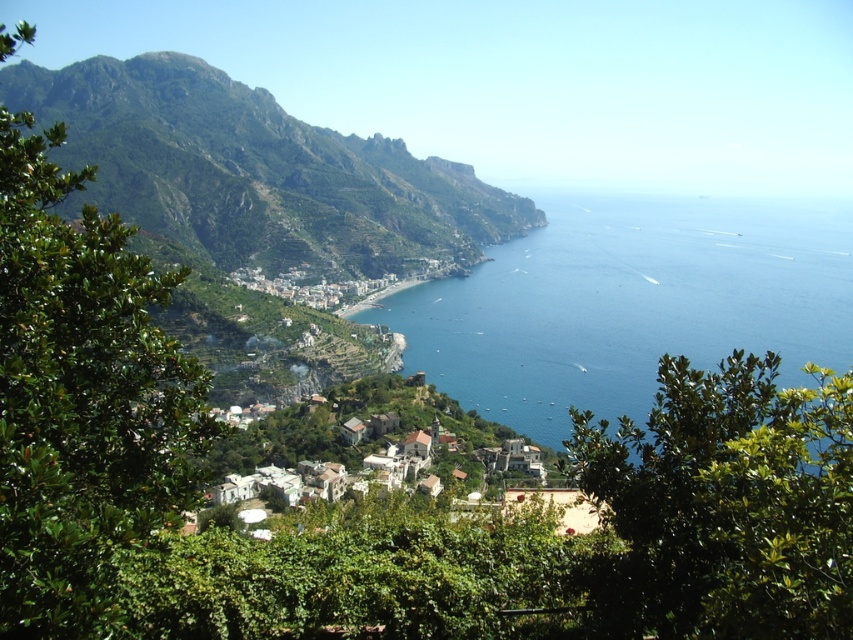
Question: Considering the relative positions of green leafy tree at left and white stucco houses at center in the image provided, where is green leafy tree at left located with respect to white stucco houses at center?

Choices:
 (A) above
 (B) below

Answer: (A)

Question: Which object is closer to the camera taking this photo?

Choices:
 (A) green leafy tree at lower right
 (B) green rocky mountain at upper left
 (C) blue liquid water at center
 (D) white stucco houses at center

Answer: (A)

Question: Does blue liquid water at center have a lesser width compared to white stucco houses at center?

Choices:
 (A) no
 (B) yes

Answer: (A)

Question: Which object is farther from the camera taking this photo?

Choices:
 (A) green rocky mountain at upper left
 (B) blue liquid water at center
 (C) green leafy tree at lower right
 (D) green leafy tree at left

Answer: (A)

Question: Estimate the real-world distances between objects in this image. Which object is closer to the blue liquid water at center?

Choices:
 (A) white stucco houses at center
 (B) green leafy tree at lower right

Answer: (A)

Question: Does blue liquid water at center have a greater width compared to white stucco houses at center?

Choices:
 (A) no
 (B) yes

Answer: (B)